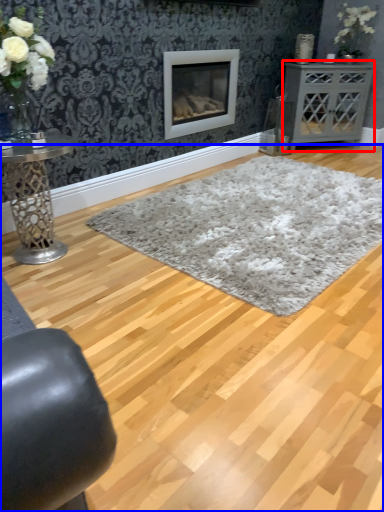
Question: Which point is closer to the camera, table (highlighted by a red box) or plain (highlighted by a blue box)?

Choices:
 (A) table
 (B) plain

Answer: (B)